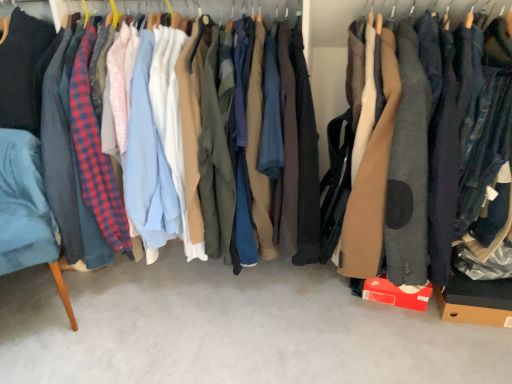
Question: Visually, is matte brown coat at center positioned to the left or to the right of matte black jacket at center?

Choices:
 (A) left
 (B) right

Answer: (B)

Question: From a real-world perspective, is matte brown coat at center positioned above or below matte black jacket at center?

Choices:
 (A) above
 (B) below

Answer: (A)

Question: Estimate the real-world distances between objects in this image. Which object is farther from the matte brown coat at center?

Choices:
 (A) brown cardboard box at lower right
 (B) velvet blue armchair at left
 (C) matte black jacket at center

Answer: (B)

Question: Estimate the real-world distances between objects in this image. Which object is farther from the brown cardboard box at lower right?

Choices:
 (A) matte black jacket at center
 (B) velvet blue armchair at left
 (C) matte brown coat at center

Answer: (B)